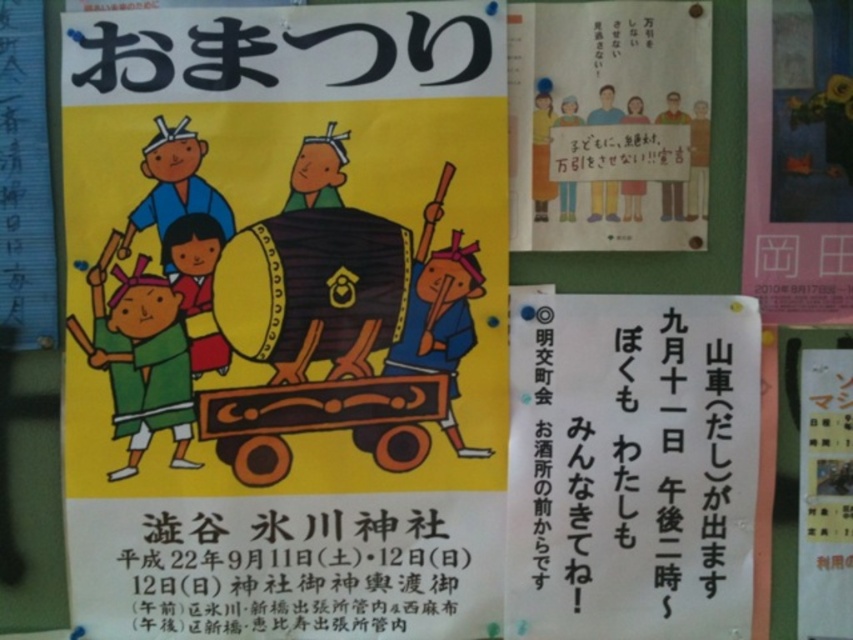
You are standing 36 inches away from the bulletin board. Can you read the black paper text at lower center without moving closer?

The black paper text at lower center is 30.64 inches from the viewer. Since you are standing 36 inches away, you are farther than the text, so you can read it without moving closer.

You are standing in front of a community bulletin board and see two points marked on it. The first point is at coordinate point (461, 566) and the second is at point (850, 16). Which point is closer to you?

Point (461, 566) is further to the camera than point (850, 16), so the point closer to you is point (850, 16).

You are standing in front of a community bulletin board and see the wooden wagon at center and the white paper poster at upper right. Which object is taller?

The white paper poster at upper right is taller than the wooden wagon at center.